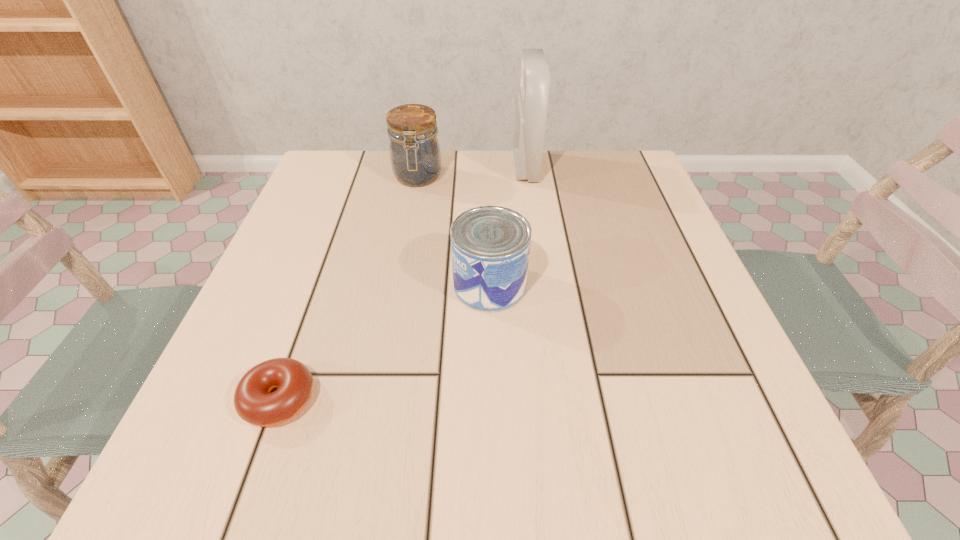
This screenshot has width=960, height=540. What are the coordinates of `object that is at the near left corner` in the screenshot? It's located at (254, 401).

Locate an element on the screen. The height and width of the screenshot is (540, 960). free spot at the far edge of the desktop is located at coordinates point(394,184).

Locate an element on the screen. vacant space at the left edge of the desktop is located at coordinates (340, 218).

This screenshot has width=960, height=540. I want to click on free space at the right edge, so click(701, 338).

Locate an element on the screen. free space at the near left corner is located at coordinates (252, 458).

The image size is (960, 540). In order to click on free spot at the far right corner of the desktop in this screenshot , I will do `click(619, 204)`.

At what (x,y) coordinates should I click in order to perform the action: click on free spot between the rightmost object and the shortest object. Please return your answer as a coordinate pair (x, y). This screenshot has height=540, width=960. Looking at the image, I should click on (402, 283).

I want to click on vacant space that's between the shortest object and the third farthest object, so [384, 342].

You are a GUI agent. You are given a task and a screenshot of the screen. Output one action in this format:
    pyautogui.click(x=<x>, y=<y>)
    Task: Click on the free point between the third object from right to left and the shortest object
    Image resolution: width=960 pixels, height=540 pixels.
    Given the screenshot: What is the action you would take?
    pyautogui.click(x=348, y=288)

Locate an element on the screen. The width and height of the screenshot is (960, 540). free space between the shortest object and the third shortest object is located at coordinates (348, 288).